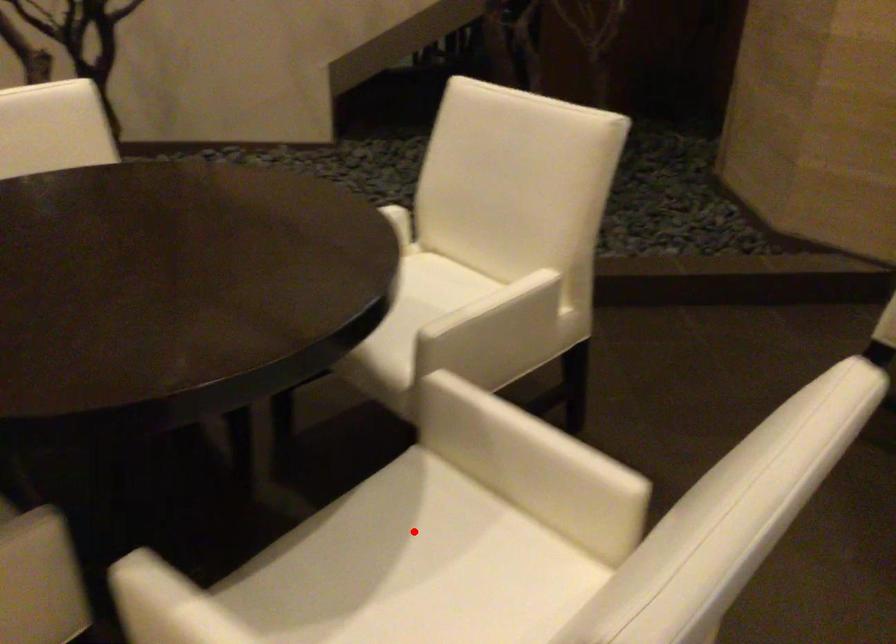
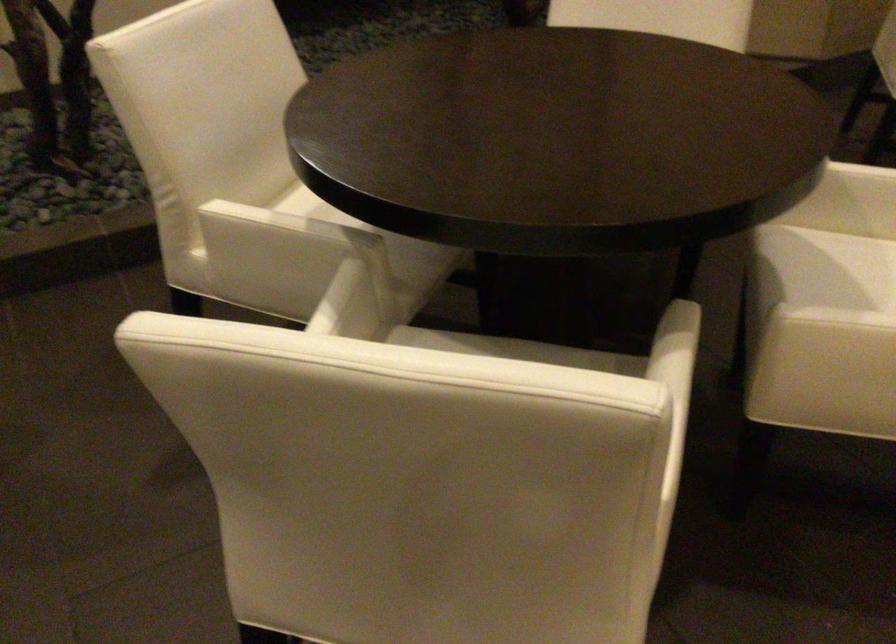
Question: I am providing you with two images of the same scene from different viewpoints. Given a red point in image1, look at the same physical point in image2. Is it:

Choices:
 (A) Closer to the viewpoint
 (B) Farther from the viewpoint

Answer: (B)